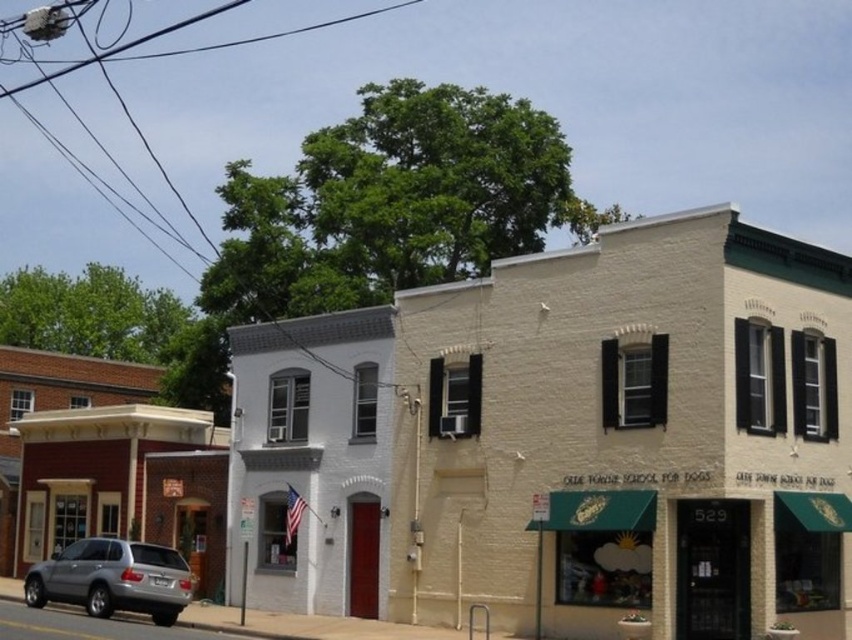
You are standing at the center of the urban street scene. There is a white matte building at center marked by point (563, 440). If you were to walk directly towards this point, which direction would you face?

The white matte building at center is located at point (563, 440), so you would face towards the center of the urban street scene to walk directly towards it.

You are standing on the street and looking at the two buildings. Which point, point (78, 451) or point (173, 54), is closer to you?

Point (78, 451) is closer to the camera than point (173, 54).

You are a delivery person trying to park your 2.5 meter wide delivery van between the white matte building at center and the brick storefront at left. Based on the scene, can you safely park your van in that space?

The white matte building at center might be wider than brick storefront at left, so there is uncertainty about whether the space between them is wide enough for the 2.5 meter van. It is safer to check the actual width before parking.